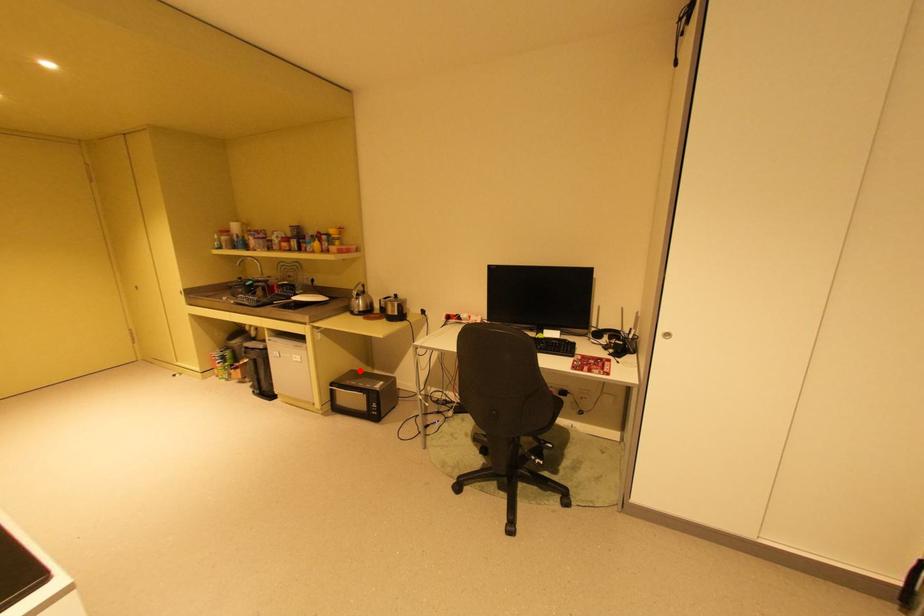
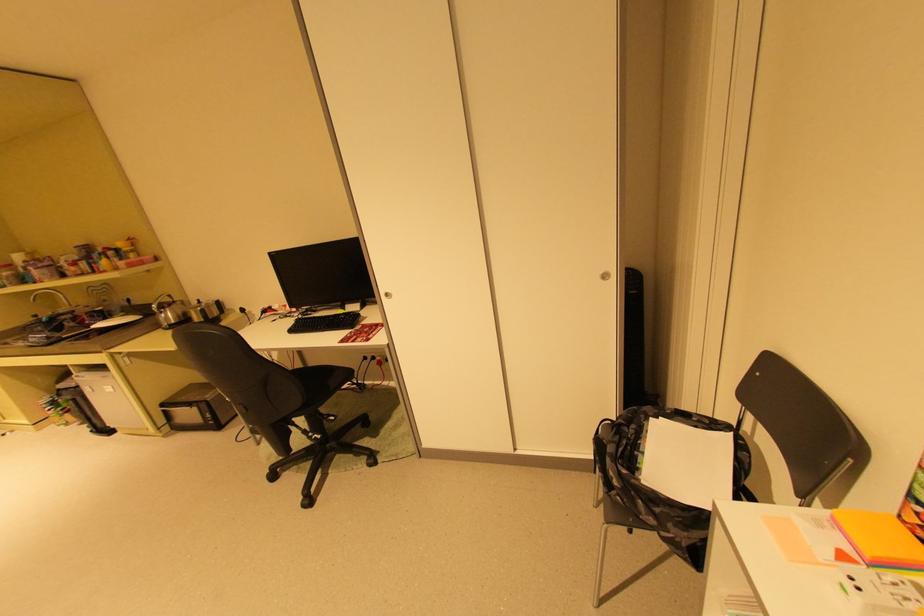
Question: I am providing you with two images of the same scene from different viewpoints. In image1, a red point is highlighted. Considering the same 3D point in image2, which of the following is correct?

Choices:
 (A) It is closer
 (B) It is farther

Answer: (B)